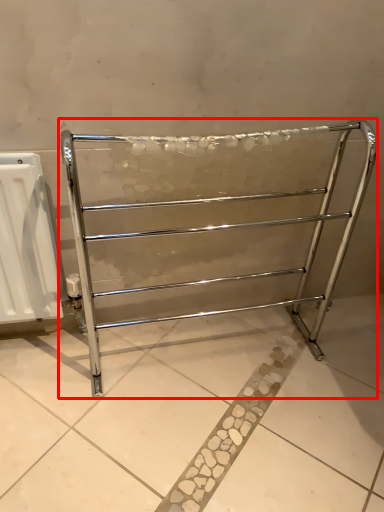
Question: From the image's perspective, what is the correct spatial relationship of furniture (annotated by the red box) in relation to radiator?

Choices:
 (A) below
 (B) above

Answer: (B)